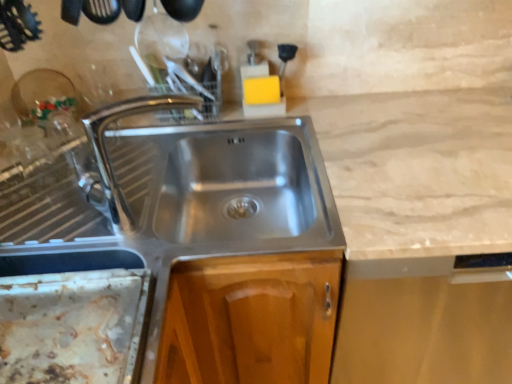
Question: From a real-world perspective, is rusty metal tray at lower left under chrome metallic tap at center?

Choices:
 (A) yes
 (B) no

Answer: (A)

Question: Is chrome metallic tap at center completely or partially inside rusty metal tray at lower left?

Choices:
 (A) no
 (B) yes

Answer: (A)

Question: Is rusty metal tray at lower left positioned far away from chrome metallic tap at center?

Choices:
 (A) no
 (B) yes

Answer: (A)

Question: Does rusty metal tray at lower left have a lesser height compared to chrome metallic tap at center?

Choices:
 (A) no
 (B) yes

Answer: (B)

Question: Considering the relative positions of rusty metal tray at lower left and chrome metallic tap at center in the image provided, is rusty metal tray at lower left to the right of chrome metallic tap at center from the viewer's perspective?

Choices:
 (A) no
 (B) yes

Answer: (A)

Question: Considering the relative sizes of rusty metal tray at lower left and chrome metallic tap at center in the image provided, is rusty metal tray at lower left thinner than chrome metallic tap at center?

Choices:
 (A) no
 (B) yes

Answer: (A)

Question: Would you consider chrome metallic tap at center to be distant from rusty metal tray at lower left?

Choices:
 (A) no
 (B) yes

Answer: (A)

Question: Is chrome metallic tap at center completely or partially outside of rusty metal tray at lower left?

Choices:
 (A) yes
 (B) no

Answer: (A)

Question: Could rusty metal tray at lower left be considered to be inside chrome metallic tap at center?

Choices:
 (A) yes
 (B) no

Answer: (B)

Question: Considering the relative sizes of chrome metallic tap at center and rusty metal tray at lower left in the image provided, is chrome metallic tap at center bigger than rusty metal tray at lower left?

Choices:
 (A) no
 (B) yes

Answer: (B)

Question: Considering the relative sizes of chrome metallic tap at center and rusty metal tray at lower left in the image provided, is chrome metallic tap at center smaller than rusty metal tray at lower left?

Choices:
 (A) no
 (B) yes

Answer: (A)

Question: Does chrome metallic tap at center have a greater width compared to rusty metal tray at lower left?

Choices:
 (A) yes
 (B) no

Answer: (B)

Question: From the image's perspective, is rusty metal tray at lower left located above or below chrome metallic tap at center?

Choices:
 (A) below
 (B) above

Answer: (A)